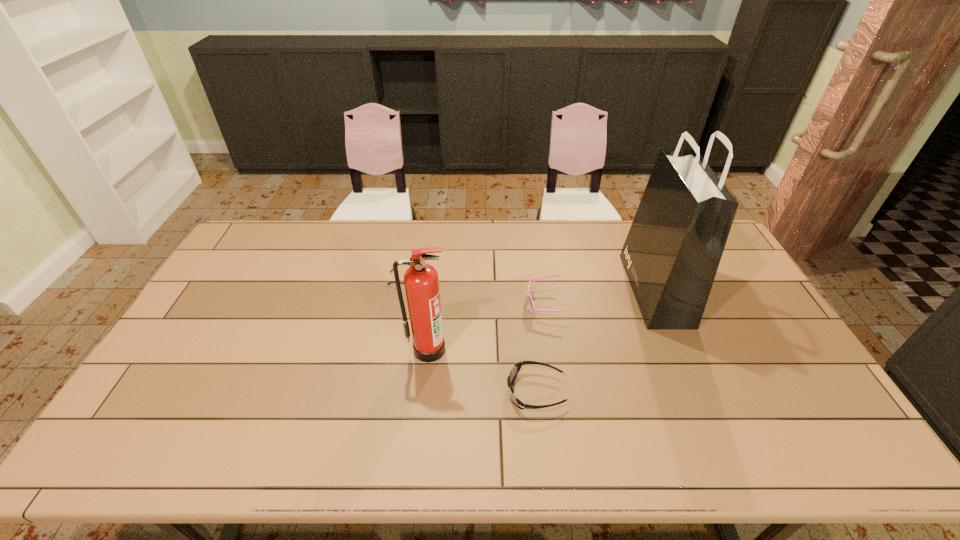
Locate an element on the screen. the tallest object is located at coordinates (671, 255).

I want to click on the rightmost object, so click(671, 255).

Locate an element on the screen. fire extinguisher is located at coordinates (421, 280).

Locate an element on the screen. The image size is (960, 540). the fourth farthest object is located at coordinates (421, 280).

The image size is (960, 540). Identify the location of the third tallest object. (531, 304).

What are the coordinates of `the nearest object` in the screenshot? It's located at (515, 370).

Identify the location of the shortest object. This screenshot has width=960, height=540. (398, 265).

You are a GUI agent. You are given a task and a screenshot of the screen. Output one action in this format:
    pyautogui.click(x=<x>, y=<y>)
    Task: Click on the shortest sunglasses
    The width and height of the screenshot is (960, 540).
    Given the screenshot: What is the action you would take?
    pyautogui.click(x=398, y=265)

You are a GUI agent. You are given a task and a screenshot of the screen. Output one action in this format:
    pyautogui.click(x=<x>, y=<y>)
    Task: Click on the vacant space located 0.310m on the front with handles of the tallest object
    The width and height of the screenshot is (960, 540).
    Given the screenshot: What is the action you would take?
    pyautogui.click(x=538, y=289)

This screenshot has height=540, width=960. I want to click on vacant space positioned on the front with handles of the tallest object, so click(x=538, y=289).